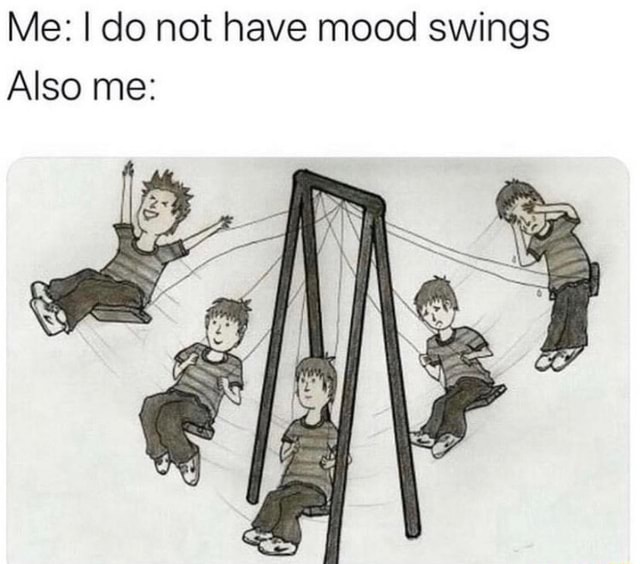
The height and width of the screenshot is (564, 640). In order to click on wooden beams in this screenshot , I will do click(x=267, y=407), click(x=315, y=316), click(x=353, y=346), click(x=390, y=332), click(x=353, y=191).